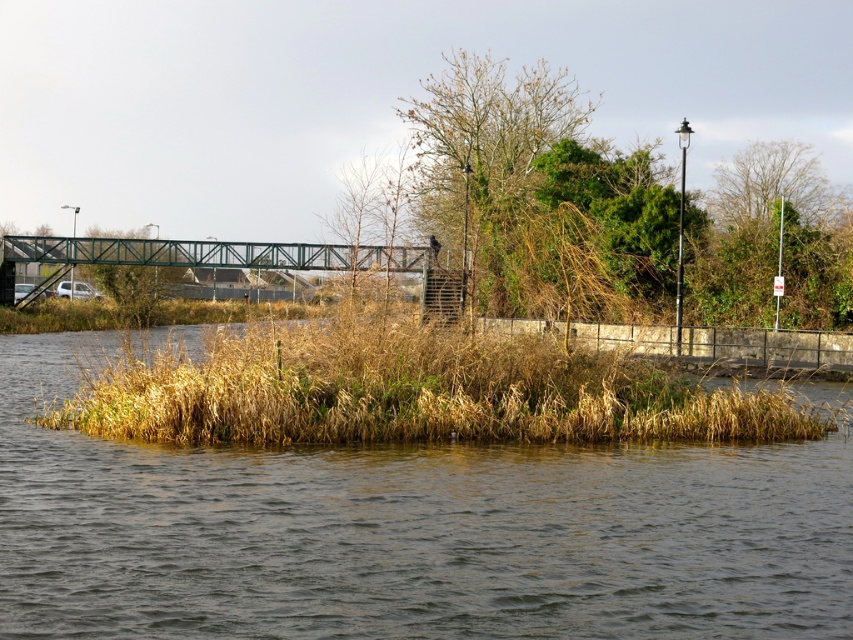
Question: Does brown grassy island at center appear over bare branches at center?

Choices:
 (A) yes
 (B) no

Answer: (B)

Question: Which point appears closest to the camera in this image?

Choices:
 (A) (286, 540)
 (B) (155, 257)
 (C) (456, 336)

Answer: (A)

Question: Is brown grass at center thinner than green metallic bridge at center?

Choices:
 (A) yes
 (B) no

Answer: (A)

Question: Which point appears farthest from the camera in this image?

Choices:
 (A) (328, 424)
 (B) (489, 248)
 (C) (45, 244)
 (D) (421, 568)

Answer: (C)

Question: Is bare branches at center to the left of green metallic bridge at center from the viewer's perspective?

Choices:
 (A) yes
 (B) no

Answer: (B)

Question: Which point is farther to the camera?

Choices:
 (A) (437, 224)
 (B) (532, 497)
 (C) (10, 252)

Answer: (C)